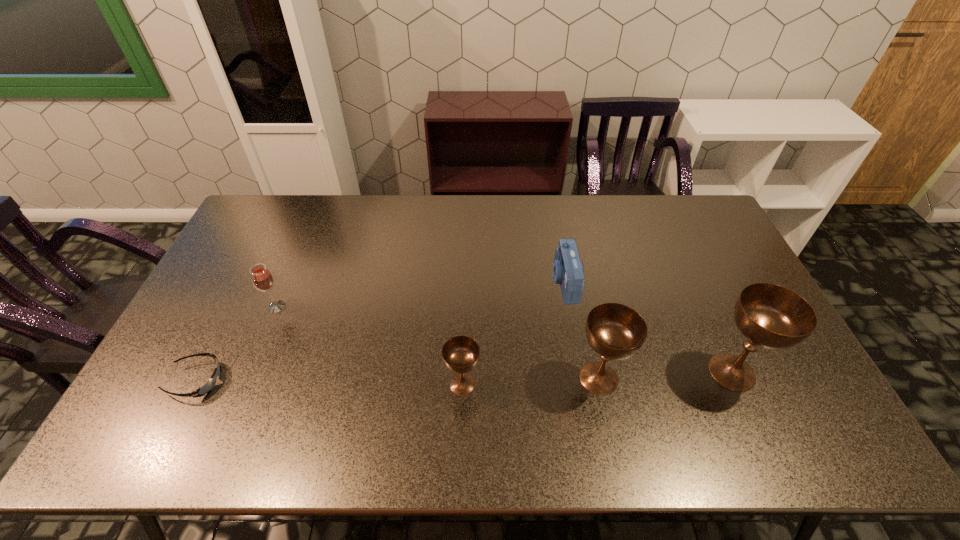
Where is `object that is at the near left corner`? The height and width of the screenshot is (540, 960). object that is at the near left corner is located at coordinates (207, 387).

Locate an element on the screen. The height and width of the screenshot is (540, 960). object positioned at the near right corner is located at coordinates (771, 316).

You are a GUI agent. You are given a task and a screenshot of the screen. Output one action in this format:
    pyautogui.click(x=<x>, y=<y>)
    Task: Click on the vacant point at the far edge
    
    Given the screenshot: What is the action you would take?
    pyautogui.click(x=383, y=199)

Locate an element on the screen. Image resolution: width=960 pixels, height=540 pixels. free region at the near edge is located at coordinates (696, 400).

Where is `free space at the right edge of the desktop`? free space at the right edge of the desktop is located at coordinates (756, 366).

The image size is (960, 540). In the image, there is a desktop. In order to click on vacant area at the far left corner in this screenshot , I will do `click(292, 201)`.

Find the location of a particular element. free space between the second shortest chalice and the fourth object from right to left is located at coordinates (531, 381).

Image resolution: width=960 pixels, height=540 pixels. Identify the location of free spot between the leftmost object and the camera. (380, 331).

Where is `free space between the camera and the wineglass`? free space between the camera and the wineglass is located at coordinates (420, 294).

Find the location of `vacant point located between the fifth tallest object and the rightmost object`. vacant point located between the fifth tallest object and the rightmost object is located at coordinates (648, 327).